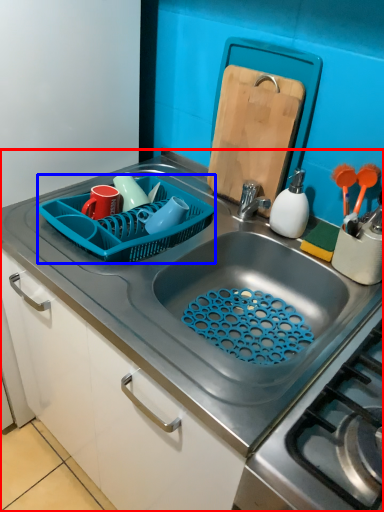
Question: Which point is closer to the camera, countertop (highlighted by a red box) or basket (highlighted by a blue box)?

Choices:
 (A) countertop
 (B) basket

Answer: (A)